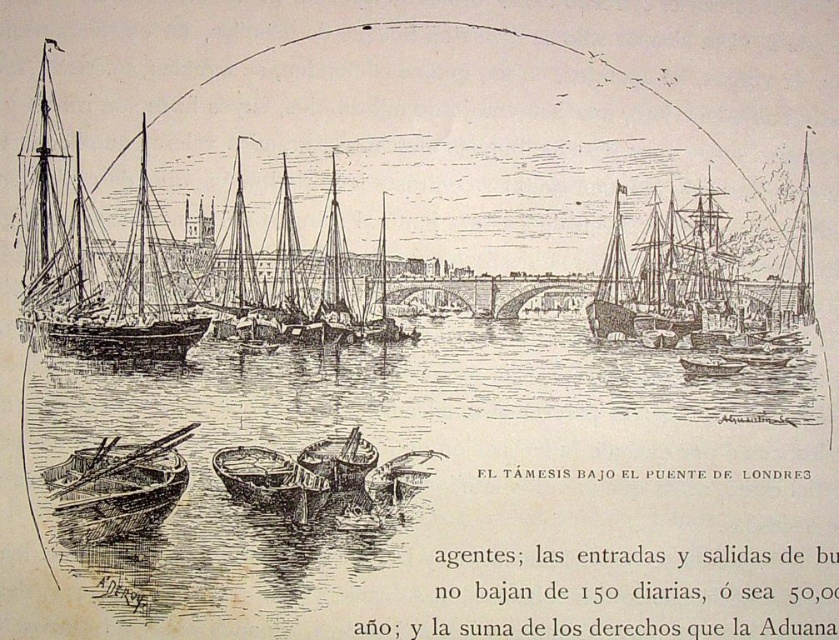
Question: Which point appears farthest from the camera in this image?

Choices:
 (A) (340, 486)
 (B) (801, 360)

Answer: (B)

Question: Does wooden boat at lower left have a larger size compared to wooden barrel at center?

Choices:
 (A) no
 (B) yes

Answer: (B)

Question: Which point appears farthest from the camera in this image?

Choices:
 (A) coord(175,470)
 (B) coord(95,419)
 (C) coord(666,314)
 (D) coord(348,488)

Answer: (C)

Question: Can you confirm if smooth wood boat at left is smaller than wooden barrel at center?

Choices:
 (A) yes
 (B) no

Answer: (B)

Question: Is wooden ship at right thinner than wooden boat at lower left?

Choices:
 (A) no
 (B) yes

Answer: (A)

Question: Which object is positioned farthest from the wooden ship at right?

Choices:
 (A) wooden barrel at center
 (B) transparent water at center

Answer: (A)